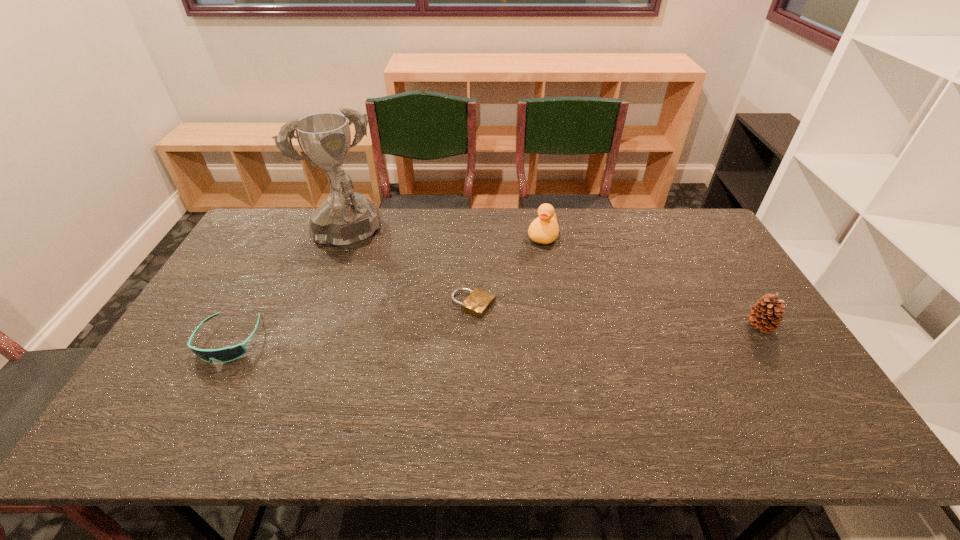
Find the location of a particular element. This screenshot has width=960, height=540. duck at the far edge is located at coordinates [544, 229].

Find the location of a particular element. The image size is (960, 540). object that is at the left edge is located at coordinates (227, 354).

Where is `object that is at the right edge`? This screenshot has height=540, width=960. object that is at the right edge is located at coordinates (766, 315).

This screenshot has width=960, height=540. In order to click on free region at the far edge of the desktop in this screenshot , I will do [389, 224].

In the image, there is a desktop. Where is `vacant space at the near edge`? vacant space at the near edge is located at coordinates pyautogui.click(x=407, y=394).

At what (x,y) coordinates should I click in order to perform the action: click on free region at the left edge of the desktop. Please return your answer as a coordinate pair (x, y). The height and width of the screenshot is (540, 960). Looking at the image, I should click on (254, 256).

The height and width of the screenshot is (540, 960). In the image, there is a desktop. What are the coordinates of `vacant space at the far left corner` in the screenshot? It's located at (293, 222).

Find the location of `vacant space that is in between the pinecone and the fourth tallest object`. vacant space that is in between the pinecone and the fourth tallest object is located at coordinates pos(495,333).

Find the location of `free space between the tallest object and the pinecone`. free space between the tallest object and the pinecone is located at coordinates (552, 282).

What are the coordinates of `vacant point located between the shortest object and the rightmost object` in the screenshot? It's located at (617, 315).